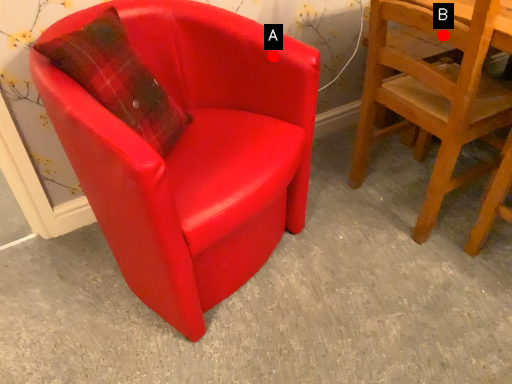
Question: Two points are circled on the image, labeled by A and B beside each circle. Which point is closer to the camera?

Choices:
 (A) A is closer
 (B) B is closer

Answer: (B)